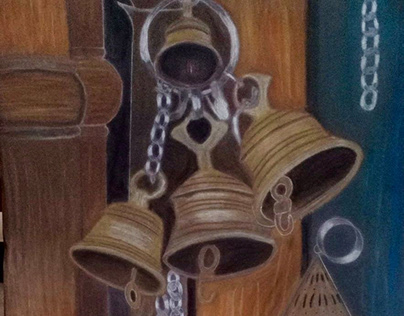
This screenshot has width=404, height=316. I want to click on wall, so click(x=383, y=190).